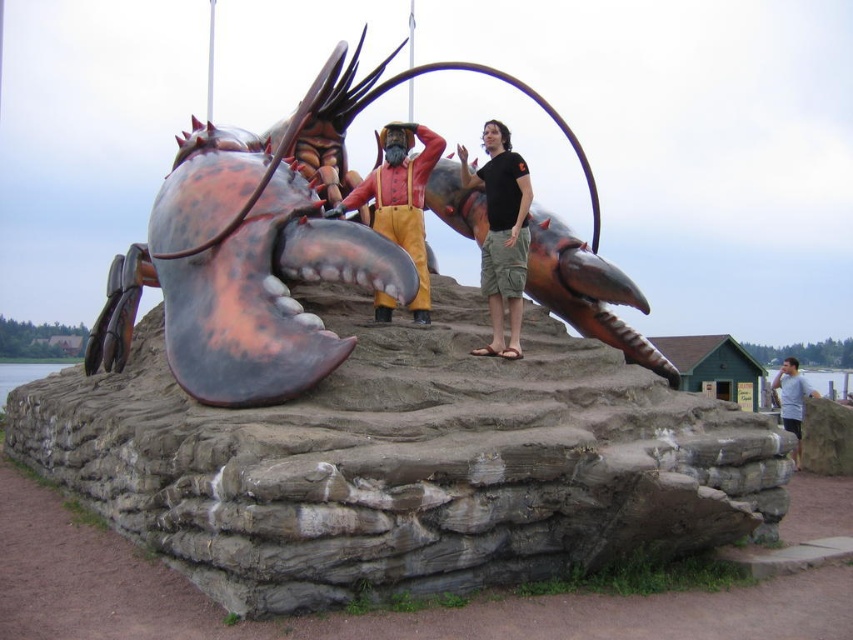
Looking at this image, you are standing at the base of the lobster sculpture and want to place a new decorative item on the ground. The coordinates provided indicate a specific location. What object is already present at point (399, 198)?

The reddish brown leather boots at center are located at point (399, 198).

You are a tourist standing on the paved path leading to the lobster sculpture. You want to take a photo of both the metallic lobster at center and the gray cotton shirt at lower right in the same frame. Which object should you position closer to the left side of your camera viewfinder to include both in the photo?

The metallic lobster at center should be positioned closer to the left side of your camera viewfinder because it is already on the left side of the gray cotton shirt at lower right.

You are standing on the paved path leading to the lobster sculpture. You want to take a photo of the metallic lobster at center and the gray cotton shirt at lower right. Which object should you focus on first to ensure both are in the frame?

You should focus on the metallic lobster at center first because it is closer to the viewer than the gray cotton shirt at lower right, so adjusting the focus starting from the closer object will help ensure both are in the frame.